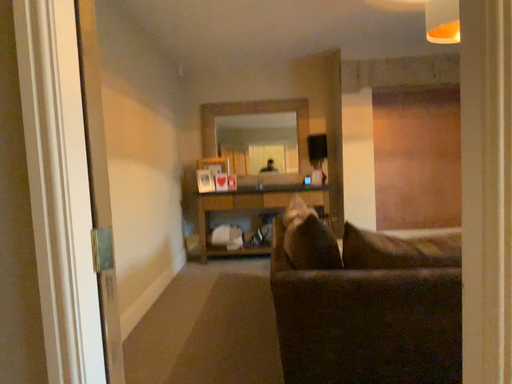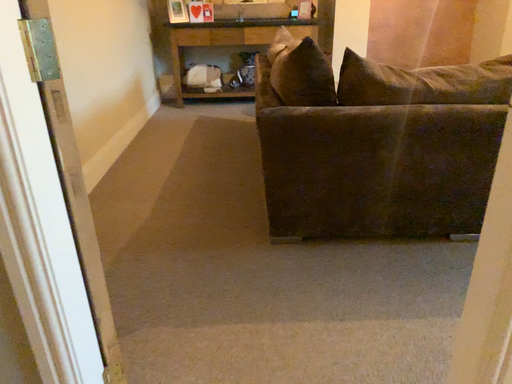
Question: How did the camera likely rotate when shooting the video?

Choices:
 (A) rotated downward
 (B) rotated upward

Answer: (A)